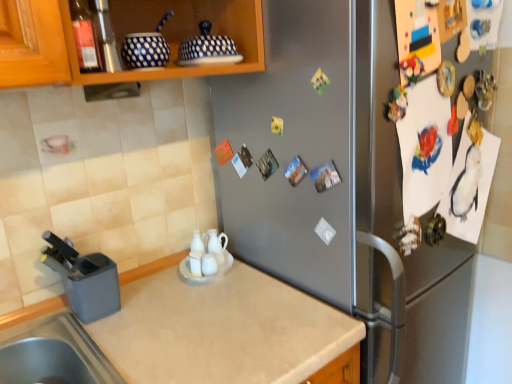
The width and height of the screenshot is (512, 384). I want to click on vacant space to the right of gray plastic knife block at lower left, which is the 1th appliance from left to right, so click(156, 307).